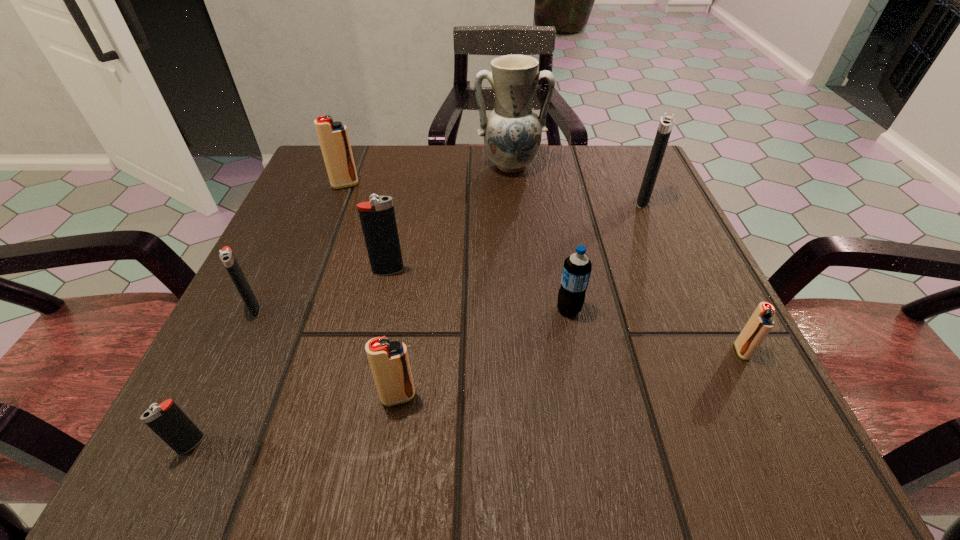
The image size is (960, 540). Find the location of `vacant area at the near edge`. vacant area at the near edge is located at coordinates (467, 408).

This screenshot has width=960, height=540. Identify the location of vacant space at the left edge. point(343,238).

You are a GUI agent. You are given a task and a screenshot of the screen. Output one action in this format:
    pyautogui.click(x=<x>, y=<y>)
    Task: Click on the vacant space at the right edge
    The height and width of the screenshot is (540, 960).
    Given the screenshot: What is the action you would take?
    pyautogui.click(x=636, y=226)

Locate an element on the screen. The width and height of the screenshot is (960, 540). vacant point at the far left corner is located at coordinates (362, 165).

Locate an element on the screen. blank area at the far right corner is located at coordinates (630, 151).

Image resolution: width=960 pixels, height=540 pixels. I want to click on vacant space at the near right corner, so click(x=772, y=399).

In order to click on vacant region between the seventh farthest object and the fourth farthest igniter in this screenshot , I will do `click(498, 330)`.

The image size is (960, 540). What are the coordinates of `free space between the third farthest igniter and the third farthest black igniter` in the screenshot? It's located at (322, 289).

Find the location of a particular element. The height and width of the screenshot is (540, 960). vacant point located between the farthest igniter and the fourth farthest igniter is located at coordinates (300, 247).

Where is `free space between the biggest red igniter and the pottery`? The height and width of the screenshot is (540, 960). free space between the biggest red igniter and the pottery is located at coordinates 427,175.